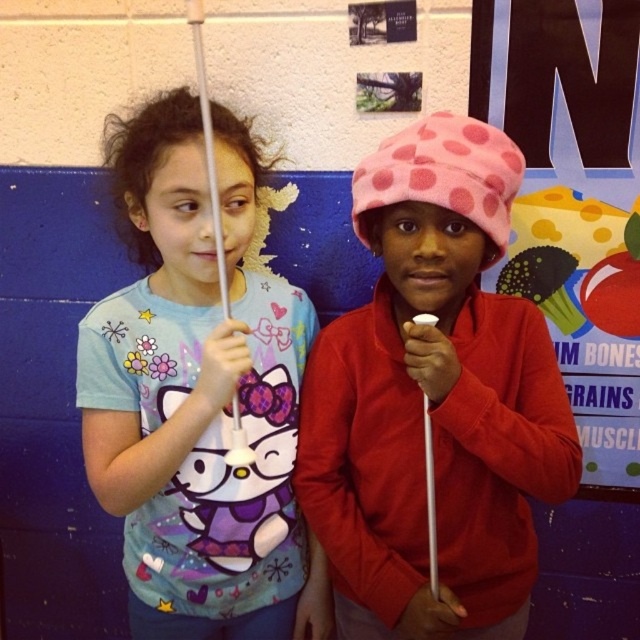
Can you confirm if pink fleece hat at center is positioned to the right of polka dot fabric hat at upper right?

Incorrect, pink fleece hat at center is not on the right side of polka dot fabric hat at upper right.

Between pink fleece hat at center and polka dot fabric hat at upper right, which one has less height?

With less height is pink fleece hat at center.

This screenshot has width=640, height=640. What do you see at coordinates (433, 401) in the screenshot?
I see `pink fleece hat at center` at bounding box center [433, 401].

What are the coordinates of `pink fleece hat at center` in the screenshot? It's located at (433, 401).

Is matte white cane at center below polka dot fabric hat at upper right?

Yes.

Is matte white cane at center taller than polka dot fabric hat at upper right?

Yes, matte white cane at center is taller than polka dot fabric hat at upper right.

Who is more forward, (300, 634) or (618, 244)?

Point (300, 634) is more forward.

Where is `matte white cane at center`? matte white cane at center is located at coordinates click(196, 394).

Is point (532, 358) farther from camera compared to point (157, 97)?

No, it is in front of (157, 97).

Who is shorter, pink fleece hat at center or matte white cane at center?

pink fleece hat at center is shorter.

Locate an element on the screen. pink fleece hat at center is located at coordinates (433, 401).